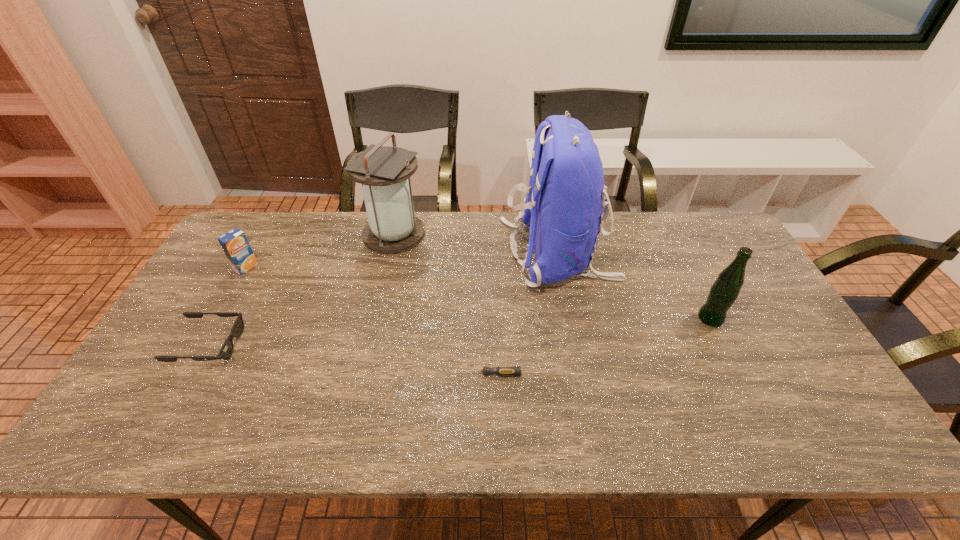
I want to click on backpack, so click(x=564, y=205).

Where is `lantern`? This screenshot has height=540, width=960. lantern is located at coordinates tap(384, 171).

Locate an element on the screen. the second tallest object is located at coordinates (384, 171).

Identify the location of the rightmost object. This screenshot has height=540, width=960. (723, 293).

I want to click on the fourth shortest object, so click(x=723, y=293).

In order to click on orange_juice in this screenshot , I will do (234, 243).

This screenshot has width=960, height=540. In order to click on the second shortest object in this screenshot , I will do `click(226, 350)`.

Identify the location of the shortest object. (501, 370).

Identify the location of screwdriver. Image resolution: width=960 pixels, height=540 pixels. (501, 370).

Where is `vacant space positioned on the back of the backpack`? This screenshot has height=540, width=960. vacant space positioned on the back of the backpack is located at coordinates (394, 253).